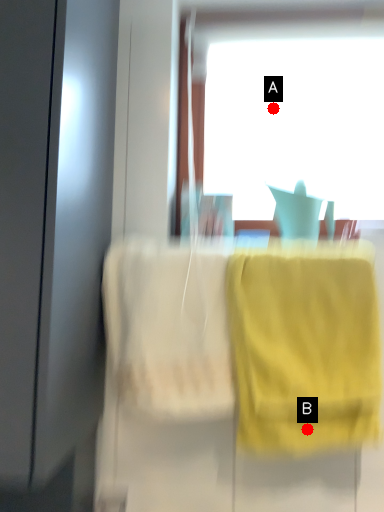
Question: Two points are circled on the image, labeled by A and B beside each circle. Which point is farther from the camera taking this photo?

Choices:
 (A) A is further
 (B) B is further

Answer: (A)